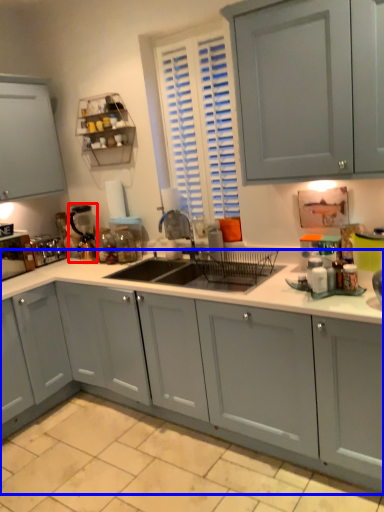
Question: Which object appears farthest to the camera in this image, appliance (highlighted by a red box) or countertop (highlighted by a blue box)?

Choices:
 (A) appliance
 (B) countertop

Answer: (A)